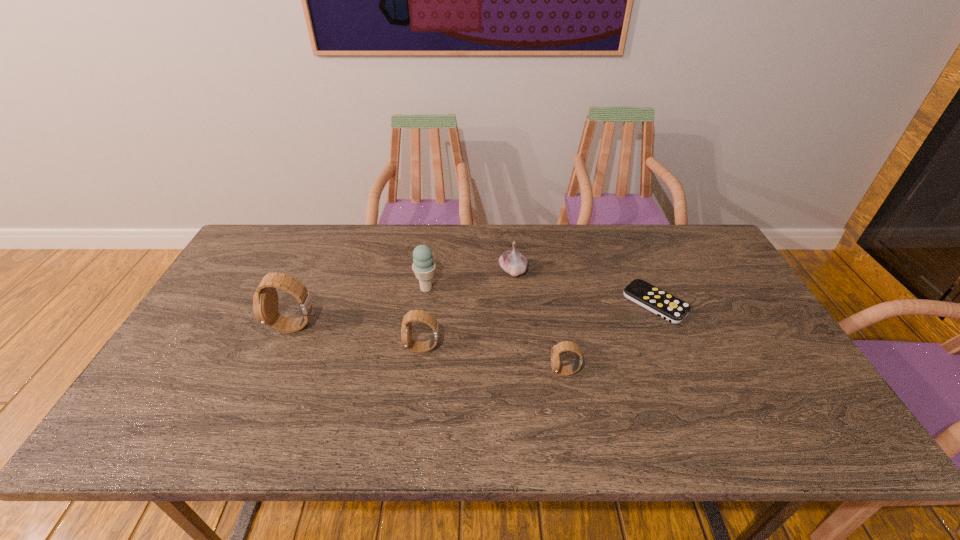
Identify the location of vacant space located on the left of the ice cream. The width and height of the screenshot is (960, 540). (309, 288).

Identify the location of blank area located on the left of the fourth object from left to right. The image size is (960, 540). (384, 271).

This screenshot has width=960, height=540. Find the location of `object that is at the far edge`. object that is at the far edge is located at coordinates [513, 262].

Locate an element on the screen. object that is positioned at the near edge is located at coordinates (563, 346).

This screenshot has height=540, width=960. In order to click on vacant area at the far edge of the desktop in this screenshot , I will do pos(312,244).

The width and height of the screenshot is (960, 540). In the image, there is a desktop. Identify the location of vacant space at the near edge. (276, 386).

Locate an element on the screen. Image resolution: width=960 pixels, height=540 pixels. free space at the left edge of the desktop is located at coordinates (181, 355).

You are a GUI agent. You are given a task and a screenshot of the screen. Output one action in this format:
    pyautogui.click(x=<x>, y=<y>)
    Task: Click on the free space at the right edge of the desktop
    
    Given the screenshot: What is the action you would take?
    pyautogui.click(x=747, y=325)

Identify the location of free space at the far left corner of the desktop. (249, 261).

The height and width of the screenshot is (540, 960). Identify the location of free space at the near left corner. (149, 408).